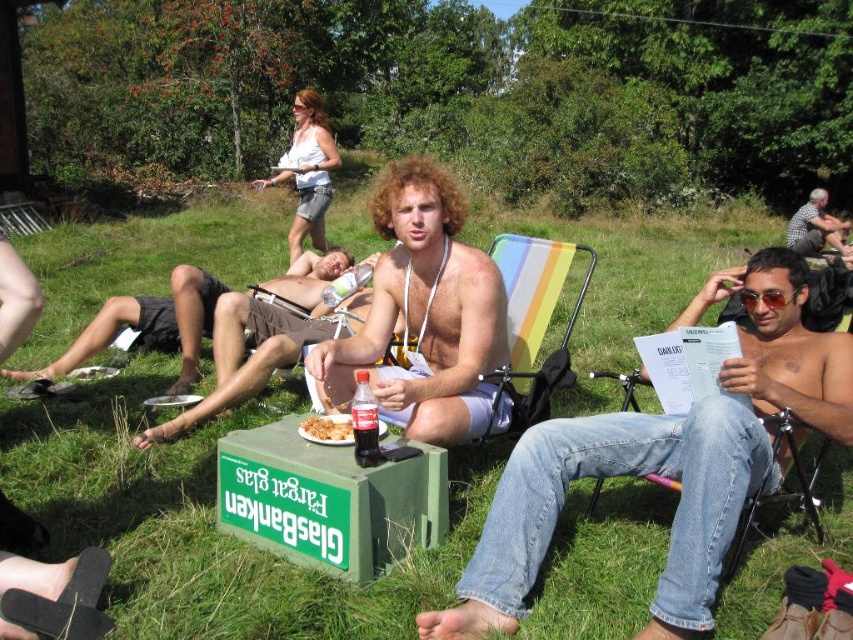
Between matte white shorts at center and dark red glass bottle at center, which one appears on the left side from the viewer's perspective?

From the viewer's perspective, dark red glass bottle at center appears more on the left side.

Describe the element at coordinates (424, 316) in the screenshot. I see `matte white shorts at center` at that location.

Identify the location of matte white shorts at center. The height and width of the screenshot is (640, 853). (424, 316).

Who is positioned more to the left, rainbow fabric beach chair at center or dark red glass bottle at center?

From the viewer's perspective, dark red glass bottle at center appears more on the left side.

Does point (508, 276) come closer to viewer compared to point (370, 419)?

No, (508, 276) is behind (370, 419).

Identify the location of rainbow fabric beach chair at center. (532, 323).

Is checkered fabric shirt at upper right taller than brown crumbly food at center?

Indeed, checkered fabric shirt at upper right has a greater height compared to brown crumbly food at center.

Which is behind, point (791, 244) or point (308, 422)?

Point (791, 244)

Which is behind, point (793, 228) or point (335, 432)?

The point (793, 228) is behind.

Where is `checkered fabric shirt at upper right`? checkered fabric shirt at upper right is located at coordinates (815, 227).